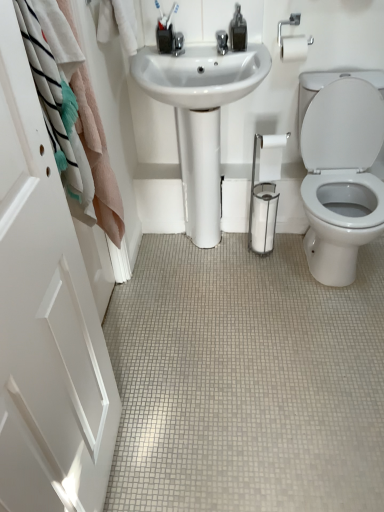
Question: Would you say white glossy sink at center contains white tile floor at center?

Choices:
 (A) no
 (B) yes

Answer: (A)

Question: Is white tile floor at center at the back of white glossy sink at center?

Choices:
 (A) yes
 (B) no

Answer: (B)

Question: Would you say white glossy sink at center is outside white tile floor at center?

Choices:
 (A) yes
 (B) no

Answer: (A)

Question: Can you confirm if white glossy sink at center is taller than white tile floor at center?

Choices:
 (A) no
 (B) yes

Answer: (B)

Question: From the image's perspective, does white glossy sink at center appear higher than white tile floor at center?

Choices:
 (A) no
 (B) yes

Answer: (B)

Question: Could you tell me if white glossy sink at center is facing white tile floor at center?

Choices:
 (A) no
 (B) yes

Answer: (B)

Question: Can you see white glossy sink at center touching white matte toilet paper at center?

Choices:
 (A) no
 (B) yes

Answer: (A)

Question: From a real-world perspective, is white glossy sink at center below white matte toilet paper at center?

Choices:
 (A) yes
 (B) no

Answer: (A)

Question: Is white glossy sink at center smaller than white matte toilet paper at center?

Choices:
 (A) yes
 (B) no

Answer: (B)

Question: Is white glossy sink at center positioned before white matte toilet paper at center?

Choices:
 (A) no
 (B) yes

Answer: (B)

Question: From the image's perspective, does white glossy sink at center appear higher than white matte toilet paper at center?

Choices:
 (A) yes
 (B) no

Answer: (A)

Question: From a real-world perspective, is white glossy sink at center located higher than white matte toilet paper at center?

Choices:
 (A) yes
 (B) no

Answer: (B)

Question: From the image's perspective, is white glossy door at left located above white tile floor at center?

Choices:
 (A) yes
 (B) no

Answer: (A)